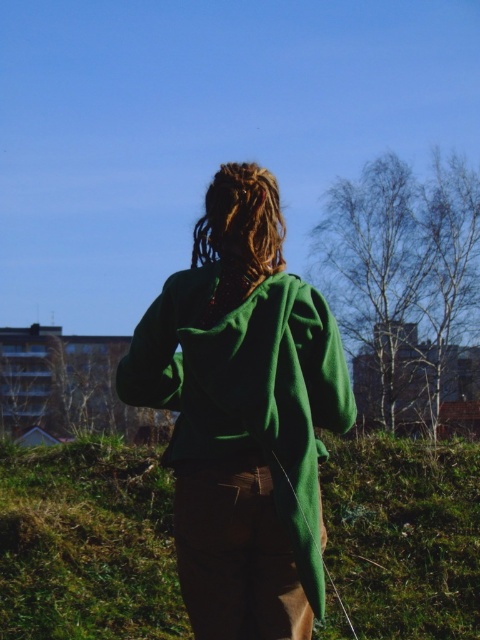
Question: Is green fleece jacket at center wider than green fabric at center?

Choices:
 (A) yes
 (B) no

Answer: (B)

Question: Among these points, which one is farthest from the camera?

Choices:
 (A) (241, 602)
 (B) (43, 579)

Answer: (B)

Question: Among these objects, which one is farthest from the camera?

Choices:
 (A) green fleece jacket at center
 (B) green fabric at center

Answer: (B)

Question: Is green fleece jacket at center wider than green fabric at center?

Choices:
 (A) yes
 (B) no

Answer: (B)

Question: Is green fleece jacket at center above green fabric at center?

Choices:
 (A) no
 (B) yes

Answer: (B)